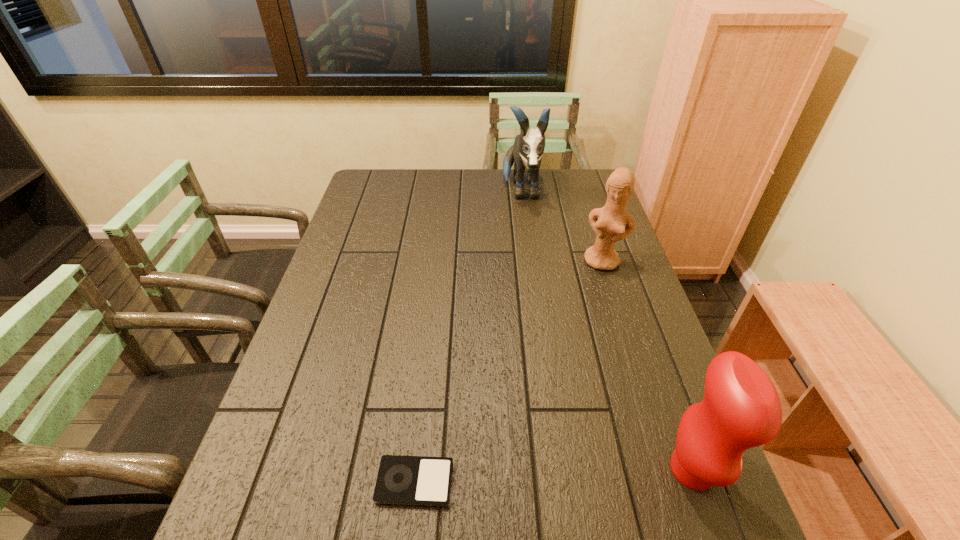
At what (x,y) coordinates should I click in order to perform the action: click on iPod. Please return your answer as a coordinate pair (x, y). The height and width of the screenshot is (540, 960). Looking at the image, I should click on 402,480.

Where is `the shortest object`? the shortest object is located at coordinates (402, 480).

The image size is (960, 540). What are the coordinates of `condiment` in the screenshot? It's located at (741, 409).

Identify the location of the second farthest object. The image size is (960, 540). (608, 222).

Where is `the third object from right to left`? the third object from right to left is located at coordinates (529, 145).

The width and height of the screenshot is (960, 540). Identify the location of puppy. (529, 145).

Locate an element on the screen. The height and width of the screenshot is (540, 960). free region located 0.370m on the right of the iPod is located at coordinates (642, 482).

Find the location of a particular element. This screenshot has width=960, height=540. free location located 0.370m on the front-facing side of the figurine is located at coordinates (570, 367).

Identify the location of vacant space located on the front-facing side of the figurine. (589, 304).

Where is `free space located 0.390m on the front-facing side of the figurine`? This screenshot has height=540, width=960. free space located 0.390m on the front-facing side of the figurine is located at coordinates (568, 373).